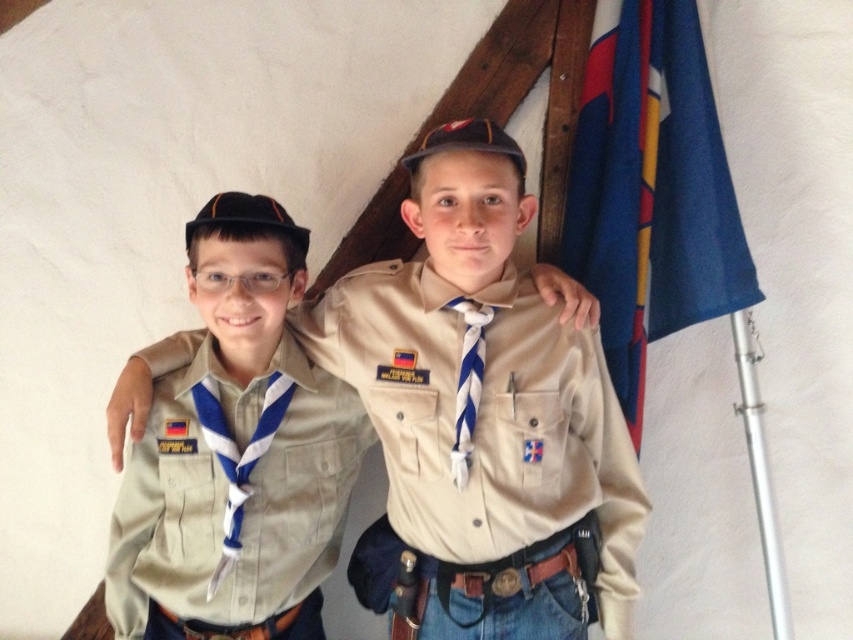
Question: Which object is closer to the camera taking this photo?

Choices:
 (A) blue fabric flag at upper right
 (B) tan fabric shirt at center
 (C) tan fabric uniform at center

Answer: (C)

Question: In this image, where is tan fabric uniform at center located relative to blue fabric flag at upper right?

Choices:
 (A) below
 (B) above

Answer: (A)

Question: Can you confirm if tan fabric uniform at center is positioned to the left of tan fabric shirt at center?

Choices:
 (A) no
 (B) yes

Answer: (A)

Question: Considering the real-world distances, which object is farthest from the blue fabric flag at upper right?

Choices:
 (A) tan fabric shirt at center
 (B) tan fabric uniform at center

Answer: (A)

Question: Is tan fabric uniform at center bigger than blue fabric flag at upper right?

Choices:
 (A) no
 (B) yes

Answer: (B)

Question: Estimate the real-world distances between objects in this image. Which object is farther from the tan fabric shirt at center?

Choices:
 (A) blue fabric flag at upper right
 (B) tan fabric uniform at center

Answer: (A)